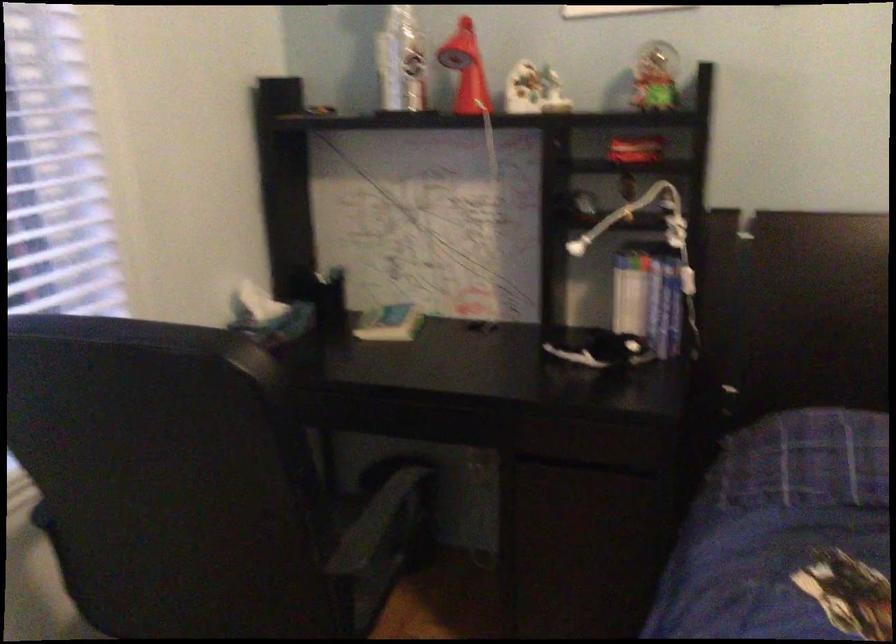
Find the location of a particular element. This screenshot has width=896, height=644. silver bottle is located at coordinates (401, 62).